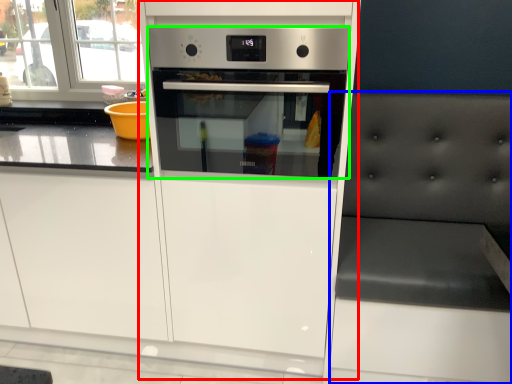
Question: Considering the real-world distances, which object is farthest from fridge (highlighted by a red box)? chair (highlighted by a blue box) or home appliance (highlighted by a green box)?

Choices:
 (A) chair
 (B) home appliance

Answer: (A)